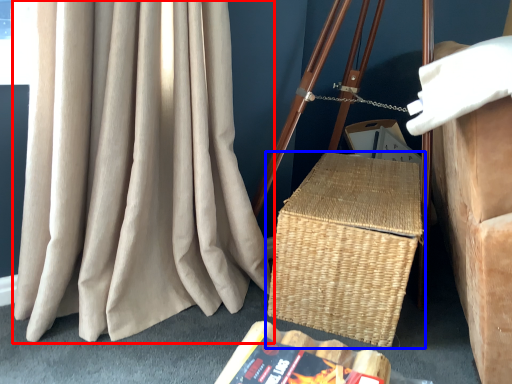
Question: Which object appears farthest to the camera in this image, curtain (highlighted by a red box) or picnic basket (highlighted by a blue box)?

Choices:
 (A) curtain
 (B) picnic basket

Answer: (B)